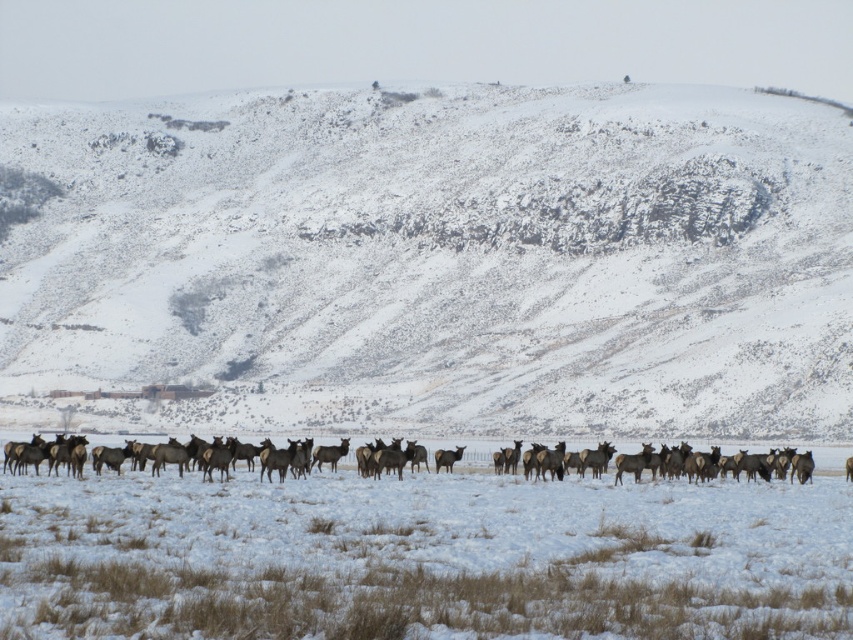
Question: Which object is farther from the camera taking this photo?

Choices:
 (A) brown fur herd at center
 (B) brown fur at center
 (C) snowy rock at center

Answer: (C)

Question: Considering the relative positions of snowy rock at center and brown fur at center in the image provided, where is snowy rock at center located with respect to brown fur at center?

Choices:
 (A) below
 (B) above

Answer: (B)

Question: Which point appears closest to the camera in this image?

Choices:
 (A) (558, 465)
 (B) (463, 449)

Answer: (A)

Question: Among these objects, which one is farthest from the camera?

Choices:
 (A) snowy rock at center
 (B) brown fur at center

Answer: (A)

Question: Is brown fur herd at center to the left of brown fur at center from the viewer's perspective?

Choices:
 (A) yes
 (B) no

Answer: (A)

Question: From the image, what is the correct spatial relationship of snowy rock at center in relation to brown fur herd at center?

Choices:
 (A) above
 (B) below

Answer: (A)